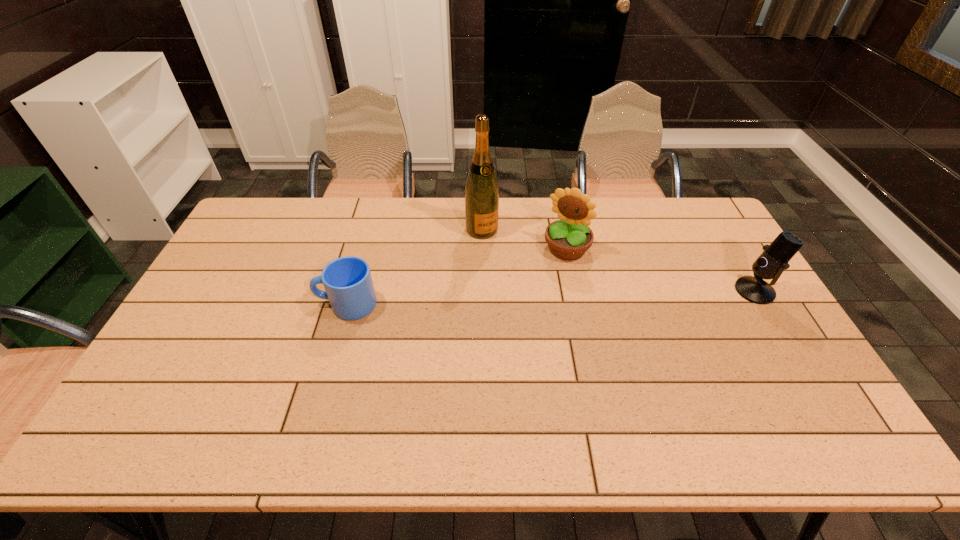
This screenshot has height=540, width=960. I want to click on mug, so click(x=347, y=280).

Identify the location of the leftmost object. The image size is (960, 540). (347, 280).

Where is `the rightmost object`? The image size is (960, 540). the rightmost object is located at coordinates (774, 259).

Where is `the third object from left to right`? the third object from left to right is located at coordinates (569, 238).

I want to click on wine bottle, so click(481, 190).

This screenshot has height=540, width=960. I want to click on the third object from right to left, so click(x=481, y=190).

Where is `vacant region located 0.360m on the side of the leftmost object with the handle`? The width and height of the screenshot is (960, 540). vacant region located 0.360m on the side of the leftmost object with the handle is located at coordinates (195, 304).

Image resolution: width=960 pixels, height=540 pixels. In order to click on free space located 0.110m on the side of the leftmost object with the handle in this screenshot , I will do `click(279, 304)`.

Where is `free region located on the side of the leftmost object with the handle`? free region located on the side of the leftmost object with the handle is located at coordinates (273, 304).

The height and width of the screenshot is (540, 960). In order to click on vacant space located on the stand of the microphone in this screenshot , I will do 667,291.